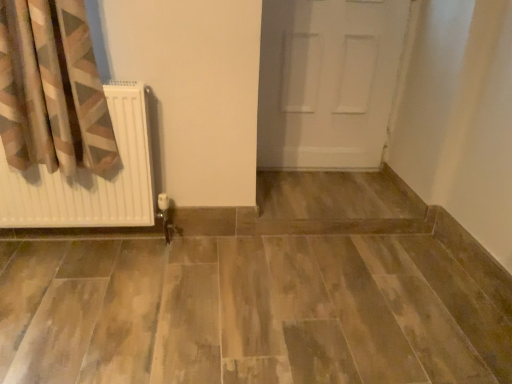
Question: Should I look upward or downward to see white matte door at center?

Choices:
 (A) up
 (B) down

Answer: (A)

Question: From the image's perspective, is white matte radiator at left on white matte door at center?

Choices:
 (A) yes
 (B) no

Answer: (B)

Question: Is white matte radiator at left positioned behind white matte door at center?

Choices:
 (A) no
 (B) yes

Answer: (A)

Question: Is white matte radiator at left far from white matte door at center?

Choices:
 (A) yes
 (B) no

Answer: (A)

Question: Can you confirm if white matte radiator at left is bigger than white matte door at center?

Choices:
 (A) no
 (B) yes

Answer: (A)

Question: Is white matte radiator at left outside of white matte door at center?

Choices:
 (A) yes
 (B) no

Answer: (A)

Question: Is white matte radiator at left aimed at white matte door at center?

Choices:
 (A) yes
 (B) no

Answer: (B)

Question: From a real-world perspective, does white matte door at center sit lower than white matte radiator at left?

Choices:
 (A) no
 (B) yes

Answer: (A)

Question: From the image's perspective, would you say white matte door at center is positioned over white matte radiator at left?

Choices:
 (A) yes
 (B) no

Answer: (A)

Question: Can you confirm if white matte door at center is taller than white matte radiator at left?

Choices:
 (A) yes
 (B) no

Answer: (A)

Question: Is white matte door at center to the left of white matte radiator at left from the viewer's perspective?

Choices:
 (A) yes
 (B) no

Answer: (B)

Question: Are white matte door at center and white matte radiator at left beside each other?

Choices:
 (A) yes
 (B) no

Answer: (B)

Question: Would you say white matte door at center is a long distance from white matte radiator at left?

Choices:
 (A) no
 (B) yes

Answer: (B)

Question: Considering their positions, is white matte radiator at left located in front of or behind white matte door at center?

Choices:
 (A) behind
 (B) front

Answer: (B)